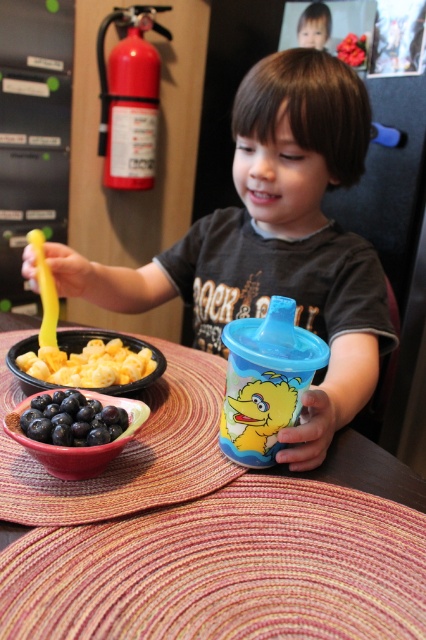
The child wants to place the blue sippy cup on the wooden placemat at center. The blue sippy cup is currently 27.06 centimeters away from the placemat. If the child can reach 30 centimeters, can they place the cup on the placemat?

The blue sippy cup is 27.06 centimeters away from the wooden placemat at center. Since the child can reach 30 centimeters, they can easily place the cup on the placemat as the distance is within their reach.